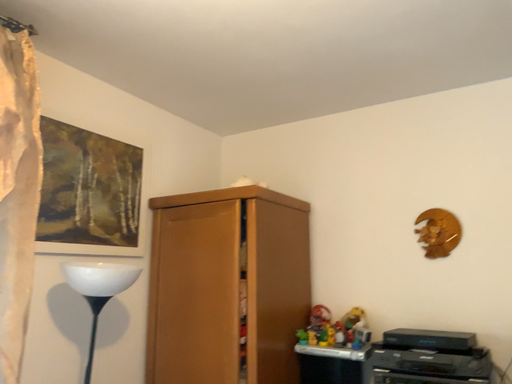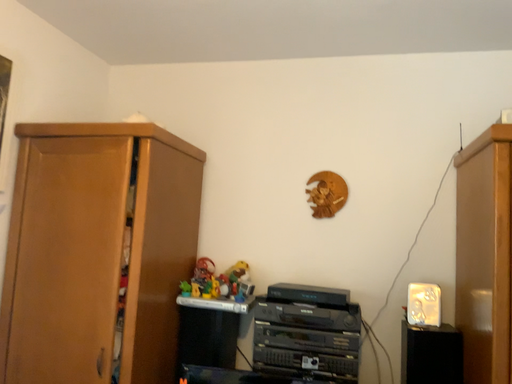
Question: Which way did the camera rotate in the video?

Choices:
 (A) rotated upward
 (B) rotated downward

Answer: (B)